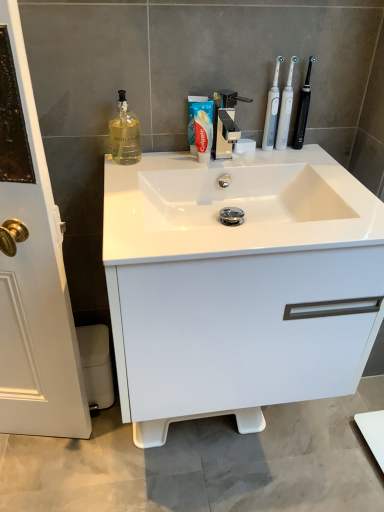
I want to click on free space to the left of white plastic toothbrush at upper right, the second toothbrush viewed from the left, so click(223, 159).